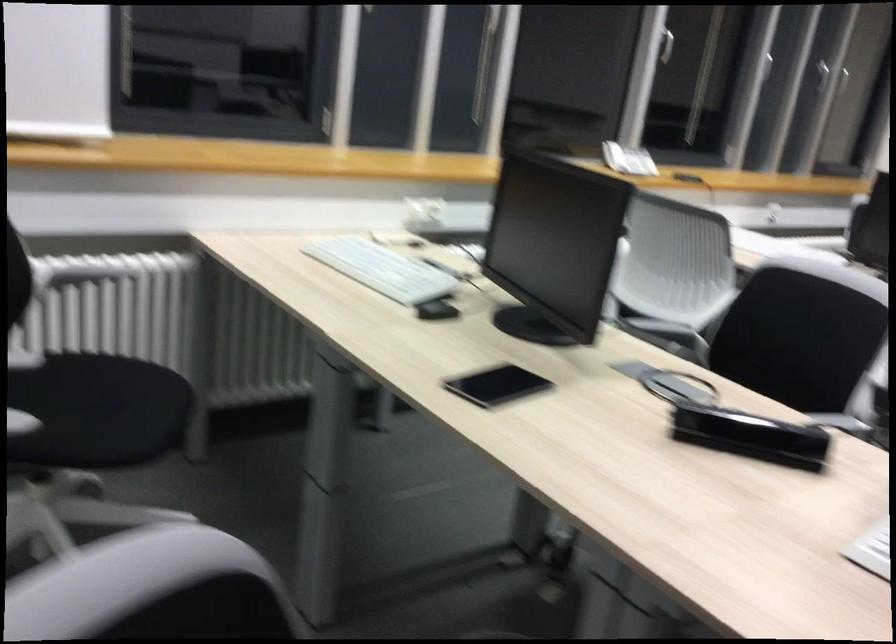
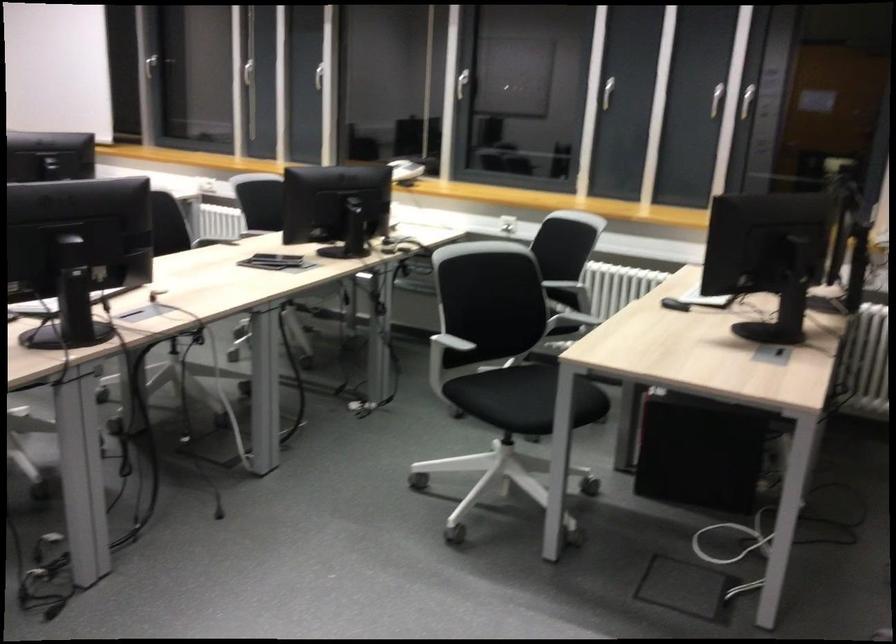
Where in the second image is the point corresponding to point 795,75 from the first image?

(607, 91)